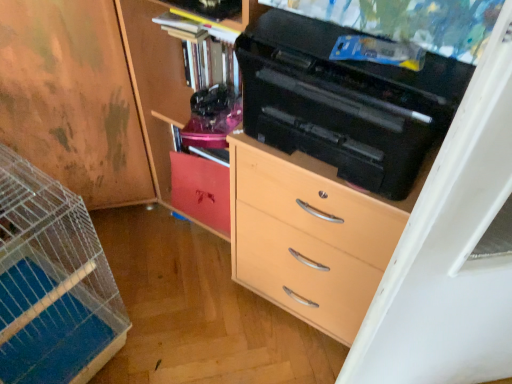
Question: Does matte wood cabinet at center, the 1th cabinetry positioned from the right, appear on the right side of matte wood chest of drawers at center?

Choices:
 (A) no
 (B) yes

Answer: (A)

Question: Is matte wood chest of drawers at center at the back of matte wood cabinet at center, the 1th cabinetry positioned from the right?

Choices:
 (A) yes
 (B) no

Answer: (B)

Question: From a real-world perspective, is matte wood cabinet at center, the 1th cabinetry positioned from the right, under matte wood chest of drawers at center?

Choices:
 (A) yes
 (B) no

Answer: (B)

Question: From the image's perspective, does matte wood cabinet at center, the 1th cabinetry positioned from the right, appear lower than matte wood chest of drawers at center?

Choices:
 (A) yes
 (B) no

Answer: (B)

Question: Is the depth of matte wood cabinet at center, the 3th cabinetry when ordered from left to right, greater than that of matte wood chest of drawers at center?

Choices:
 (A) no
 (B) yes

Answer: (B)

Question: In the image, is matte wood chest of drawers at center on the left side or the right side of matte wood cabinet at center, the 3th cabinetry when ordered from left to right?

Choices:
 (A) right
 (B) left

Answer: (A)

Question: Is matte wood chest of drawers at center in front of or behind matte wood cabinet at center, the 3th cabinetry when ordered from left to right, in the image?

Choices:
 (A) behind
 (B) front

Answer: (B)

Question: Is matte wood chest of drawers at center bigger or smaller than matte wood cabinet at center, the 3th cabinetry when ordered from left to right?

Choices:
 (A) big
 (B) small

Answer: (B)

Question: From the image's perspective, is matte wood chest of drawers at center above or below matte wood cabinet at center, the 1th cabinetry positioned from the right?

Choices:
 (A) below
 (B) above

Answer: (A)

Question: Based on their sizes in the image, would you say matte wood cabinet at center, placed as the 2th cabinetry when sorted from left to right, is bigger or smaller than matte wood cabinet at center, the 1th cabinetry positioned from the right?

Choices:
 (A) small
 (B) big

Answer: (A)

Question: Relative to matte wood cabinet at center, the 1th cabinetry positioned from the right, is matte wood cabinet at center, arranged as the second cabinetry when viewed from the right, in front or behind?

Choices:
 (A) behind
 (B) front

Answer: (A)

Question: Is point (190, 200) positioned closer to the camera than point (170, 59)?

Choices:
 (A) closer
 (B) farther

Answer: (B)

Question: From the image's perspective, is matte wood cabinet at center, placed as the 2th cabinetry when sorted from left to right, located above or below matte wood cabinet at center, the 1th cabinetry positioned from the right?

Choices:
 (A) above
 (B) below

Answer: (B)

Question: Which is correct: matte wood cabinet at center, the 3th cabinetry when ordered from left to right, is inside wooden cabinet at left, which appears as the 1th cabinetry when viewed from the left, or outside of it?

Choices:
 (A) outside
 (B) inside

Answer: (A)

Question: Based on their sizes in the image, would you say matte wood cabinet at center, the 1th cabinetry positioned from the right, is bigger or smaller than wooden cabinet at left, the 3th cabinetry from the right?

Choices:
 (A) small
 (B) big

Answer: (A)